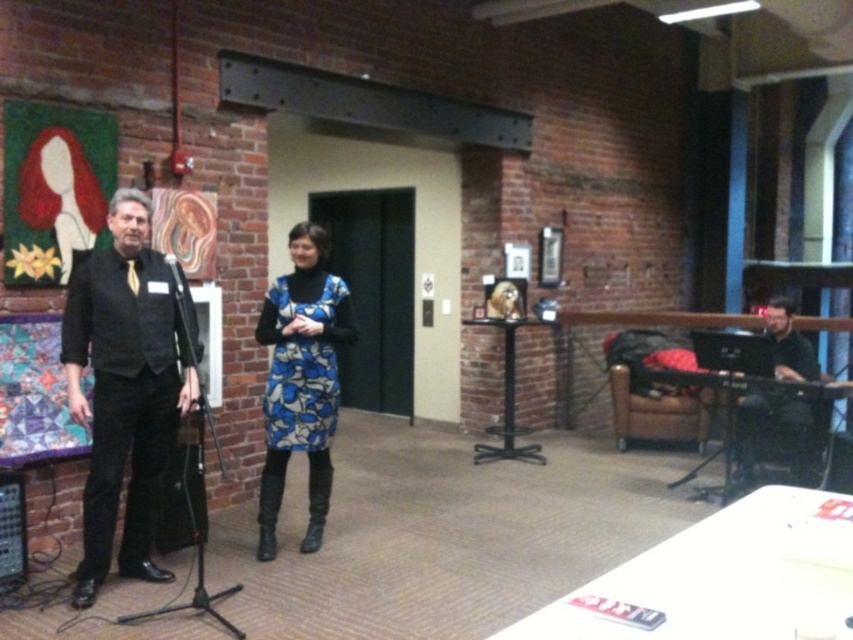
Question: Is black textured suit at left to the right of black matte laptop at right from the viewer's perspective?

Choices:
 (A) no
 (B) yes

Answer: (A)

Question: Which point is closer to the camera?

Choices:
 (A) black matte laptop at right
 (B) black textured suit at left

Answer: (B)

Question: Is black textured suit at left below black matte laptop at right?

Choices:
 (A) no
 (B) yes

Answer: (A)

Question: Which point is closer to the camera taking this photo?

Choices:
 (A) (780, 406)
 (B) (164, 256)
 (C) (119, 355)

Answer: (C)

Question: Can you confirm if black textured suit at left is bigger than black matte laptop at right?

Choices:
 (A) yes
 (B) no

Answer: (B)

Question: Which point is closer to the camera?

Choices:
 (A) (128, 548)
 (B) (276, 484)
 (C) (177, 262)

Answer: (C)